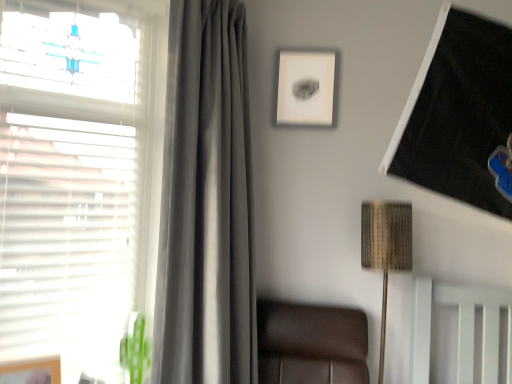
Image resolution: width=512 pixels, height=384 pixels. What do you see at coordinates (386, 249) in the screenshot?
I see `woven fabric lampshade at upper right` at bounding box center [386, 249].

At what (x,y) coordinates should I click in order to perform the action: click on satin gray curtain at left. Please return your answer as a coordinate pair (x, y). The height and width of the screenshot is (384, 512). Looking at the image, I should click on (206, 203).

Can you confirm if white matte window at left is shorter than woven fabric lampshade at upper right?

In fact, white matte window at left may be taller than woven fabric lampshade at upper right.

From a real-world perspective, which object rests below the other?

woven fabric lampshade at upper right is physically lower.

Which point is more distant from viewer, (74, 134) or (392, 238)?

The point (392, 238) is farther.

Locate an element on the screen. window that is on the left side of woven fabric lampshade at upper right is located at coordinates (79, 179).

Is woven fabric lampshade at upper right facing away from wooden picture frame at lower left, the 1th picture frame ordered from the bottom?

woven fabric lampshade at upper right does not have its back to wooden picture frame at lower left, the 1th picture frame ordered from the bottom.

In the image, is woven fabric lampshade at upper right on the left side or the right side of wooden picture frame at lower left, the first picture frame viewed from the left?

woven fabric lampshade at upper right is to the right of wooden picture frame at lower left, the first picture frame viewed from the left.

Is woven fabric lampshade at upper right placed right next to wooden picture frame at lower left, positioned as the 2th picture frame in back-to-front order?

They are not placed beside each other.

How far apart are woven fabric lampshade at upper right and wooden picture frame at lower left, marked as the second picture frame in a top-to-bottom arrangement?

woven fabric lampshade at upper right and wooden picture frame at lower left, marked as the second picture frame in a top-to-bottom arrangement, are 4.63 feet apart.

Is woven fabric lampshade at upper right next to matte white picture frame at upper center, positioned as the first picture frame in back-to-front order, and touching it?

woven fabric lampshade at upper right and matte white picture frame at upper center, positioned as the first picture frame in back-to-front order, are clearly separated.

From the image's perspective, does woven fabric lampshade at upper right appear higher than matte white picture frame at upper center, placed as the first picture frame when sorted from right to left?

Actually, woven fabric lampshade at upper right appears below matte white picture frame at upper center, placed as the first picture frame when sorted from right to left, in the image.

Who is more distant, woven fabric lampshade at upper right or matte white picture frame at upper center, acting as the 2th picture frame starting from the left?

matte white picture frame at upper center, acting as the 2th picture frame starting from the left, is more distant.

Is white matte window at left outside of satin gray curtain at left?

That's correct, white matte window at left is outside of satin gray curtain at left.

Considering the positions of objects white matte window at left and satin gray curtain at left in the image provided, who is more to the right, white matte window at left or satin gray curtain at left?

From the viewer's perspective, satin gray curtain at left appears more on the right side.

Find the location of a particular element. The height and width of the screenshot is (384, 512). window on the left of satin gray curtain at left is located at coordinates (79, 179).

Considering the relative sizes of white matte window at left and satin gray curtain at left in the image provided, is white matte window at left taller than satin gray curtain at left?

Incorrect, the height of white matte window at left is not larger of that of satin gray curtain at left.

From a real-world perspective, which is physically above, woven fabric lampshade at upper right or white matte window at left?

white matte window at left.

Is woven fabric lampshade at upper right wider than white matte window at left?

No.

Is woven fabric lampshade at upper right aimed at white matte window at left?

No, woven fabric lampshade at upper right does not turn towards white matte window at left.

From the image's perspective, between satin gray curtain at left and white matte window at left, which one is located above?

white matte window at left.

In the image, there is a satin gray curtain at left. Where is `window above it (from the image's perspective)`? Image resolution: width=512 pixels, height=384 pixels. window above it (from the image's perspective) is located at coordinates (79, 179).

Could white matte window at left be considered to be inside satin gray curtain at left?

No, satin gray curtain at left does not contain white matte window at left.

Does satin gray curtain at left have a smaller size compared to white matte window at left?

Actually, satin gray curtain at left might be larger than white matte window at left.

From the image's perspective, is white matte window at left located above or below matte white picture frame at upper center, the 2th picture frame from the front?

Clearly, from the image's perspective, white matte window at left is below matte white picture frame at upper center, the 2th picture frame from the front.

Which object is further away from the camera taking this photo, white matte window at left or matte white picture frame at upper center, the 2th picture frame from the front?

Positioned behind is matte white picture frame at upper center, the 2th picture frame from the front.

At what (x,y) coordinates should I click in order to perform the action: click on window below the matte white picture frame at upper center, positioned as the first picture frame in back-to-front order (from the image's perspective). Please return your answer as a coordinate pair (x, y). Looking at the image, I should click on (79, 179).

Identify the location of lamp located behind the white matte window at left. (386, 249).

Find the location of a particular element. The height and width of the screenshot is (384, 512). lamp that appears above the wooden picture frame at lower left, marked as the second picture frame in a top-to-bottom arrangement (from a real-world perspective) is located at coordinates (386, 249).

Based on the photo, considering their positions, is white matte window at left positioned further to wooden picture frame at lower left, the second picture frame positioned from the right, than matte white picture frame at upper center, the 2th picture frame from the front?

matte white picture frame at upper center, the 2th picture frame from the front.

Which object lies further to the anchor point wooden picture frame at lower left, marked as the second picture frame in a top-to-bottom arrangement, matte white picture frame at upper center, which ranks as the 1th picture frame in top-to-bottom order, or satin gray curtain at left?

matte white picture frame at upper center, which ranks as the 1th picture frame in top-to-bottom order, lies further to wooden picture frame at lower left, marked as the second picture frame in a top-to-bottom arrangement, than the other object.

From the image, which object appears to be nearer to woven fabric lampshade at upper right, white matte window at left or matte white picture frame at upper center, acting as the 2th picture frame starting from the left?

Among the two, matte white picture frame at upper center, acting as the 2th picture frame starting from the left, is located nearer to woven fabric lampshade at upper right.

Based on their spatial positions, is matte white picture frame at upper center, acting as the 2th picture frame starting from the left, or woven fabric lampshade at upper right further from satin gray curtain at left?

woven fabric lampshade at upper right.

Estimate the real-world distances between objects in this image. Which object is closer to wooden picture frame at lower left, the second picture frame positioned from the right, woven fabric lampshade at upper right or white matte window at left?

The object closer to wooden picture frame at lower left, the second picture frame positioned from the right, is white matte window at left.

From the picture: Estimate the real-world distances between objects in this image. Which object is closer to wooden picture frame at lower left, the second picture frame positioned from the right, woven fabric lampshade at upper right or satin gray curtain at left?

The object closer to wooden picture frame at lower left, the second picture frame positioned from the right, is satin gray curtain at left.

Estimate the real-world distances between objects in this image. Which object is closer to satin gray curtain at left, woven fabric lampshade at upper right or matte white picture frame at upper center, placed as the first picture frame when sorted from right to left?

The object closer to satin gray curtain at left is matte white picture frame at upper center, placed as the first picture frame when sorted from right to left.

Considering their positions, is matte white picture frame at upper center, which ranks as the 1th picture frame in top-to-bottom order, positioned further to white matte window at left than woven fabric lampshade at upper right?

Among the two, woven fabric lampshade at upper right is located further to white matte window at left.

Locate an element on the screen. picture frame between wooden picture frame at lower left, marked as the second picture frame in a top-to-bottom arrangement, and woven fabric lampshade at upper right is located at coordinates (306, 88).

Find the location of a particular element. The width and height of the screenshot is (512, 384). curtain between white matte window at left and wooden picture frame at lower left, marked as the second picture frame in a top-to-bottom arrangement, vertically is located at coordinates coord(206,203).

I want to click on picture frame situated between white matte window at left and woven fabric lampshade at upper right from left to right, so click(x=306, y=88).

Where is `curtain that lies between matte white picture frame at upper center, placed as the first picture frame when sorted from right to left, and wooden picture frame at lower left, the first picture frame viewed from the left, from top to bottom`? The width and height of the screenshot is (512, 384). curtain that lies between matte white picture frame at upper center, placed as the first picture frame when sorted from right to left, and wooden picture frame at lower left, the first picture frame viewed from the left, from top to bottom is located at coordinates (206, 203).